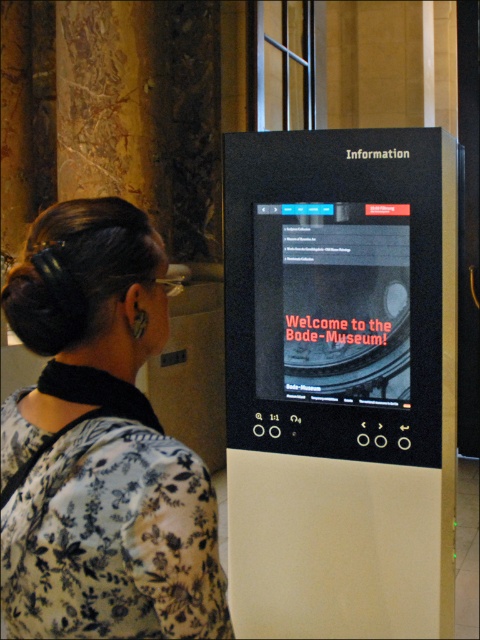
You are standing in front of the interactive kiosk at the Bode Museum. You see two points marked on the kiosk screen at coordinates point (365, 252) and point (7, 454). Which point is closer to you?

Point (7, 454) is closer to you because it is closer to the camera than point (365, 252).

You are standing in front of the Bode Museum and need to interact with the black plastic information kiosk at center. However, there is a person wearing a black floral dress at center in front of it. Can you directly access the kiosk without moving the person?

The black plastic information kiosk at center is further to the viewer than the black floral dress at center, meaning the person in the black floral dress at center is blocking your direct path to the kiosk. You would need to ask them to move or go around them to access the kiosk.